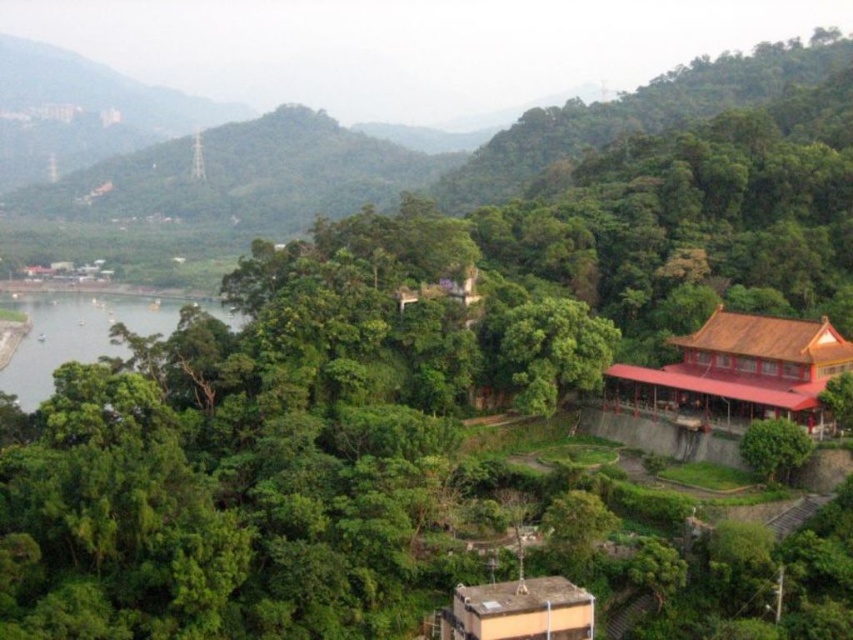
You are standing in the lush landscape and want to walk from the green leafy tree at center to the green leafy tree at lower right. Which direction should you walk to move away from the traditional building with a red roof?

To move away from the traditional building with a red roof, you should walk towards the green leafy tree at lower right, as it is farther from the building compared to the green leafy tree at center.

You are standing at the viewpoint and want to reach the point marked at coordinates point (502, 349). Given that your walking speed is 1.5 meters per second, how many seconds will it take you to reach that point?

The point marked at coordinates point (502, 349) is 109.38 meters away from the viewer. At a walking speed of 1.5 meters per second, it would take approximately 72.92 seconds to reach that point.

You are a hiker who wants to take a photo of the green leafy tree at center and the green leafy tree at lower right. Which tree should you stand closer to in order to capture both trees in the frame without zooming in?

You should stand closer to the green leafy tree at lower right since it is smaller in size than the green leafy tree at center, allowing both to fit in the frame when positioned appropriately.